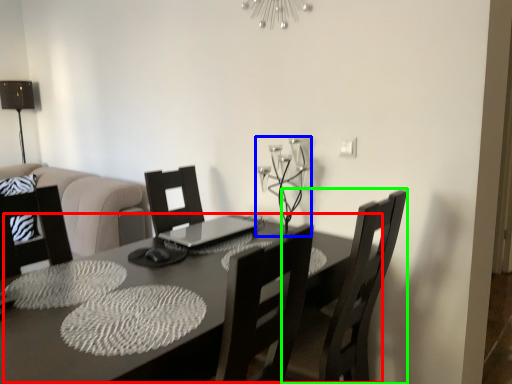
Question: Which is nearer to the table (highlighted by a red box)? candle holder (highlighted by a blue box) or chair (highlighted by a green box).

Choices:
 (A) candle holder
 (B) chair

Answer: (B)